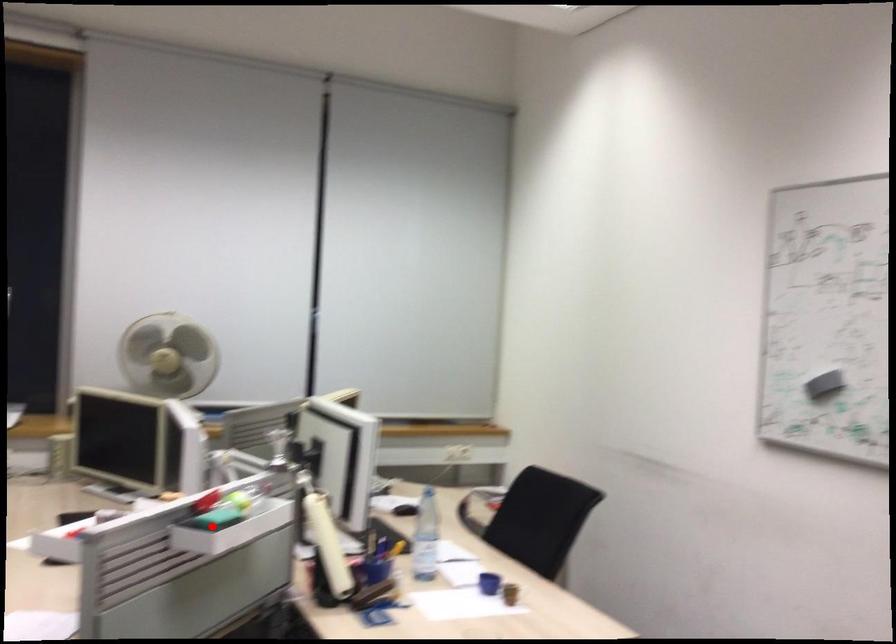
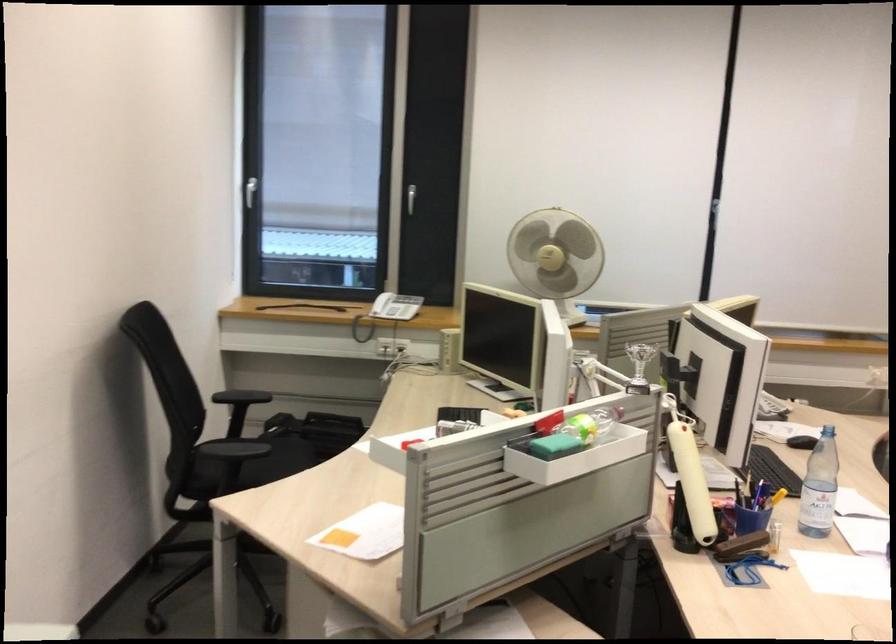
Question: I am providing you with two images of the same scene from different viewpoints. In image1, a red point is highlighted. Considering the same 3D point in image2, which of the following is correct?

Choices:
 (A) It is closer
 (B) It is farther

Answer: (A)